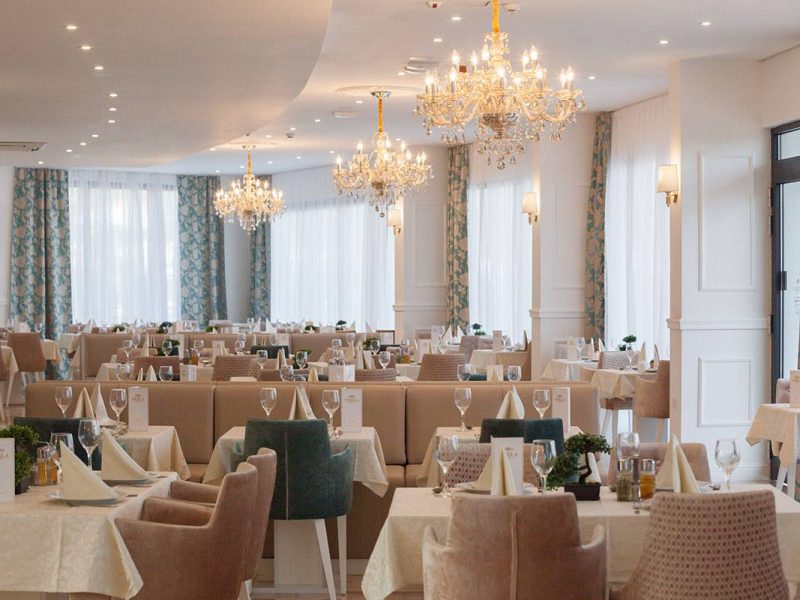
Where is `lights`? The image size is (800, 600). lights is located at coordinates (386, 172), (250, 192), (390, 222), (530, 209), (664, 182).